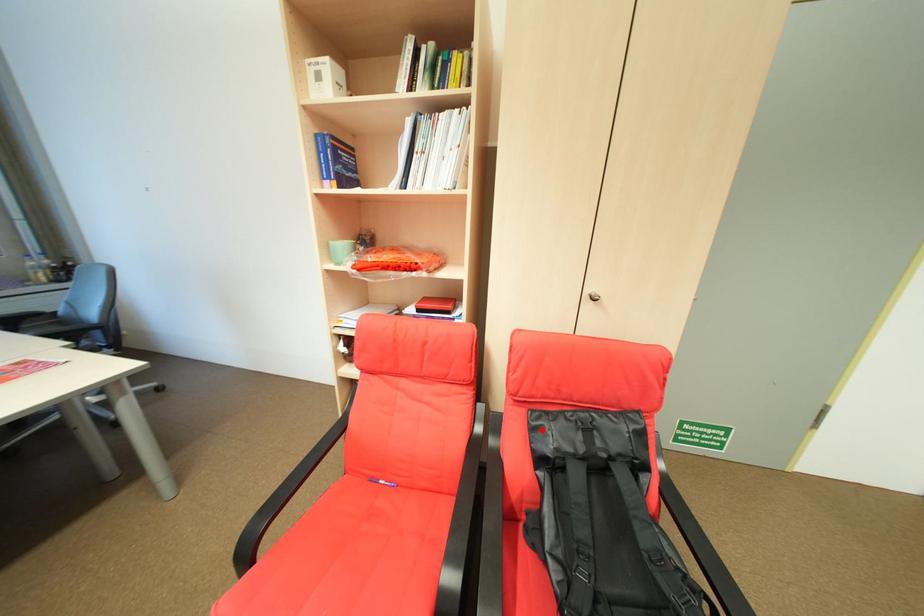
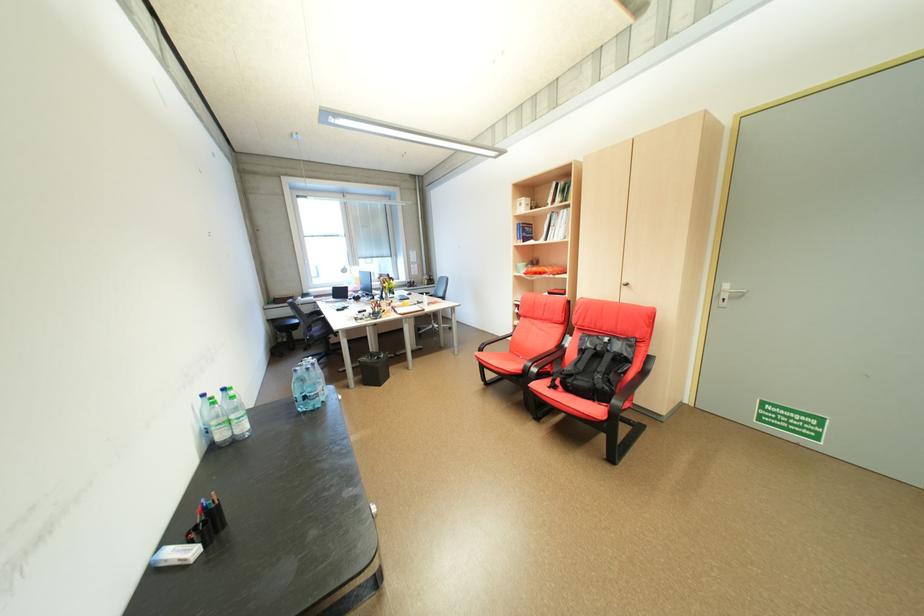
The point at the highlighted location is marked in the first image. Where is the corresponding point in the second image?

(590, 339)